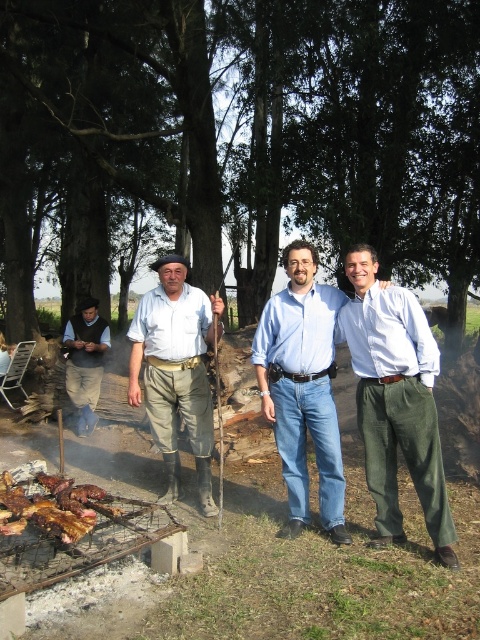
You are a photographer trying to capture a group photo of the three men. You notice the green cotton pants at right and the matte khaki pants at center. Which pair of pants should you focus on to ensure they appear larger in the photo?

The matte khaki pants at center should be focused on to ensure they appear larger in the photo since they are larger than the green cotton pants at right.